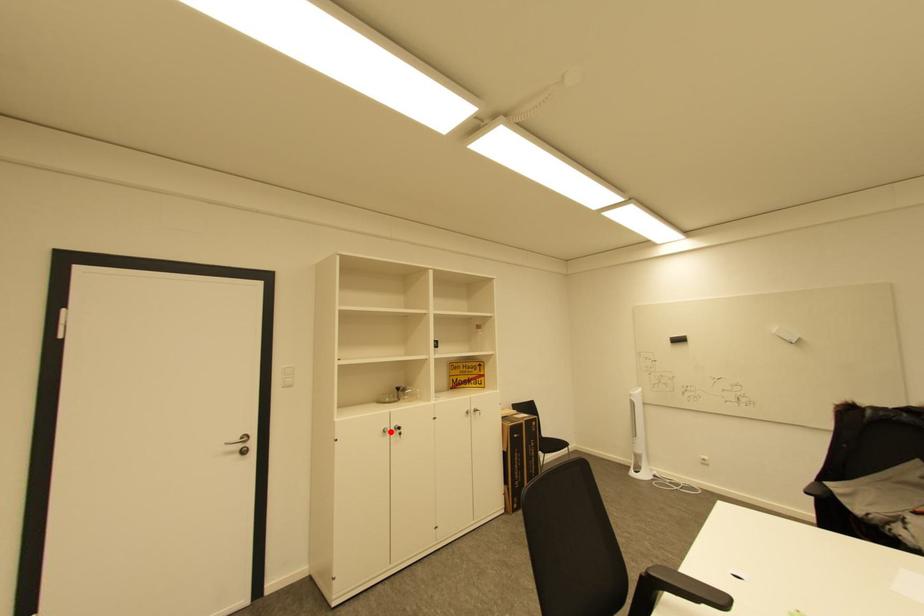
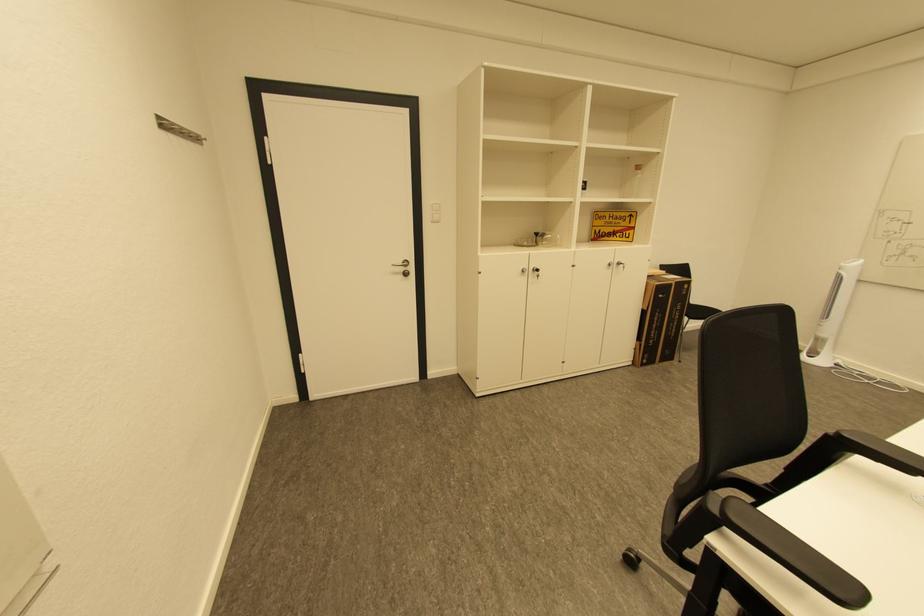
Locate, in the second image, the point that corresponds to the highlighted location in the first image.

(529, 272)